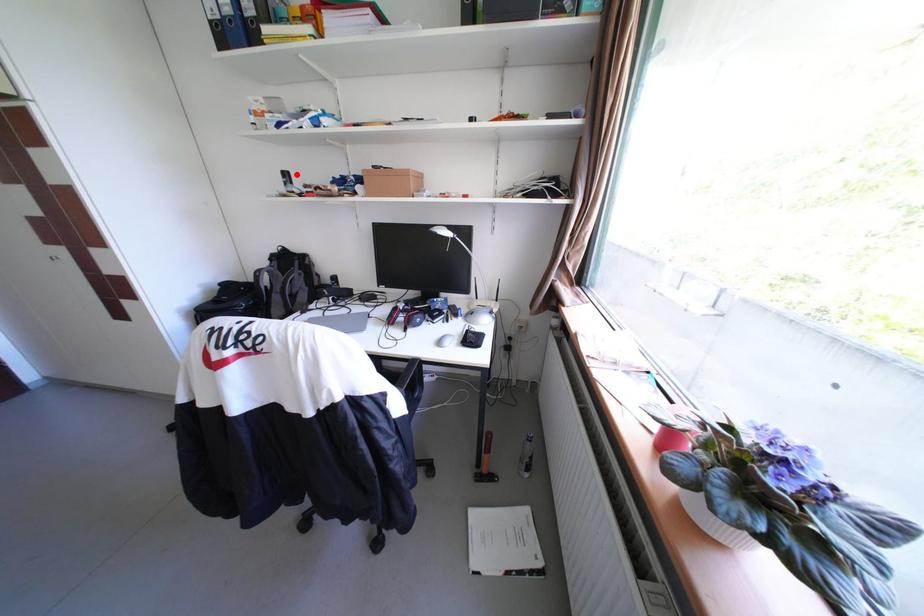
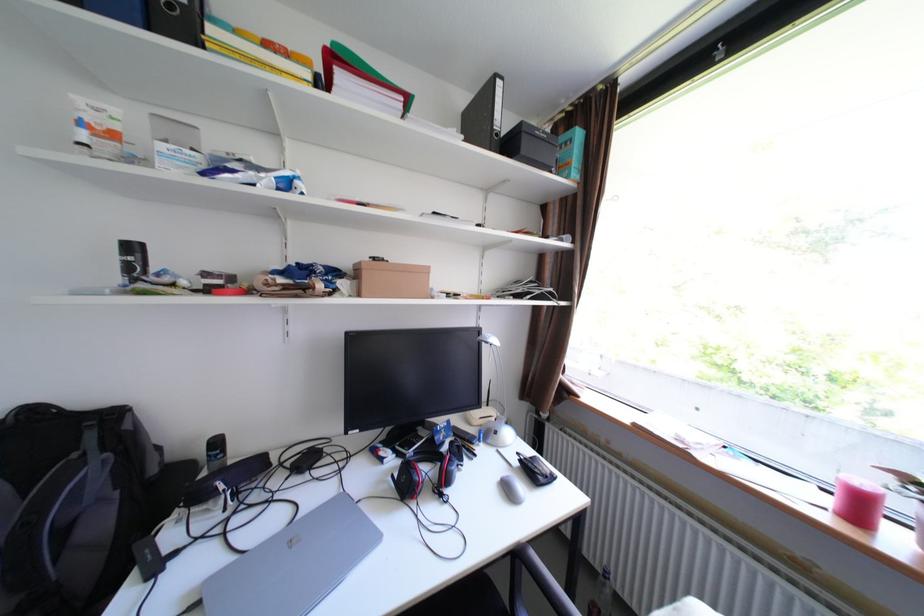
The point at the highlighted location is marked in the first image. Where is the corresponding point in the second image?

(143, 248)